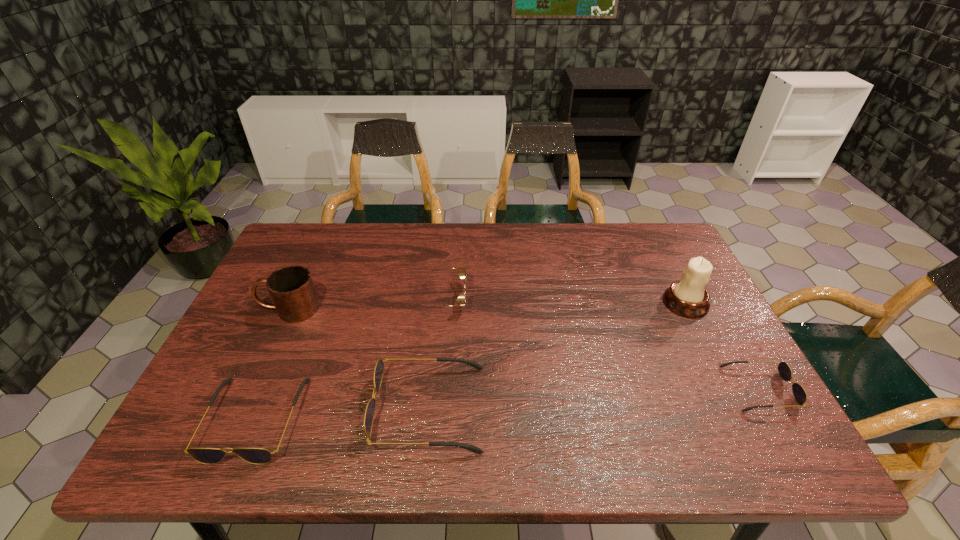
Find the location of a particular element. The width and height of the screenshot is (960, 540). mug that is positioned at the left edge is located at coordinates (291, 288).

Image resolution: width=960 pixels, height=540 pixels. I want to click on sunglasses that is positioned at the right edge, so click(785, 372).

The width and height of the screenshot is (960, 540). In order to click on candle holder at the right edge in this screenshot , I will do `click(687, 297)`.

Identify the location of object located in the near left corner section of the desktop. (209, 456).

Find the location of a particular element. object present at the near right corner is located at coordinates (785, 372).

In the image, there is a desktop. What are the coordinates of `vacant area at the far edge` in the screenshot? It's located at (369, 238).

Find the location of `free space at the near edge of the desktop`. free space at the near edge of the desktop is located at coordinates (475, 394).

In order to click on free location at the left edge of the desktop in this screenshot , I will do `click(244, 322)`.

Find the location of a particular element. vacant space at the right edge is located at coordinates (709, 376).

The height and width of the screenshot is (540, 960). I want to click on vacant space at the near left corner of the desktop, so click(x=250, y=396).